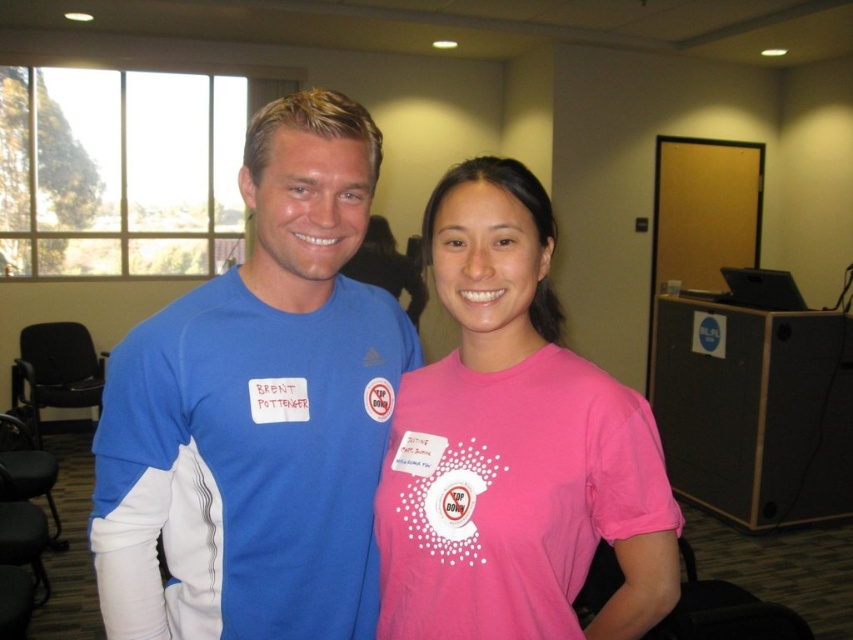
Is blue fabric shirt at left further to camera compared to pink matte shirt at center?

Yes, it is.

Who is positioned more to the right, blue fabric shirt at left or pink matte shirt at center?

pink matte shirt at center

Describe the element at coordinates (258, 412) in the screenshot. I see `blue fabric shirt at left` at that location.

I want to click on blue fabric shirt at left, so click(258, 412).